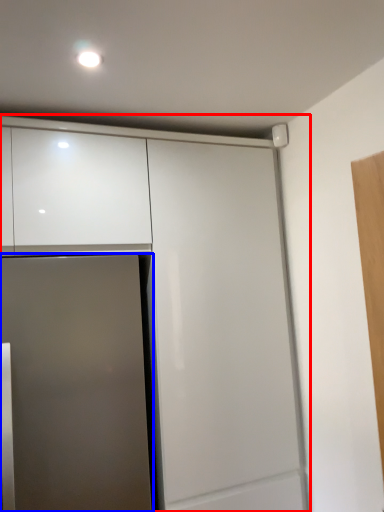
Question: Which of the following is the closest to the observer, cabinetry (highlighted by a red box) or door (highlighted by a blue box)?

Choices:
 (A) cabinetry
 (B) door

Answer: (B)